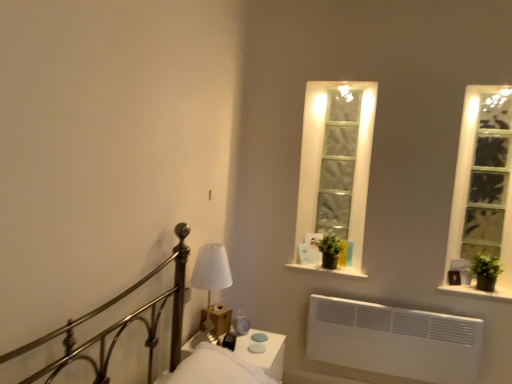
At what (x,y) coordinates should I click in order to perform the action: click on free space above clear glass window at right (from a real-world perspective). Please return your answer as a coordinate pair (x, y). Looking at the image, I should click on (495, 100).